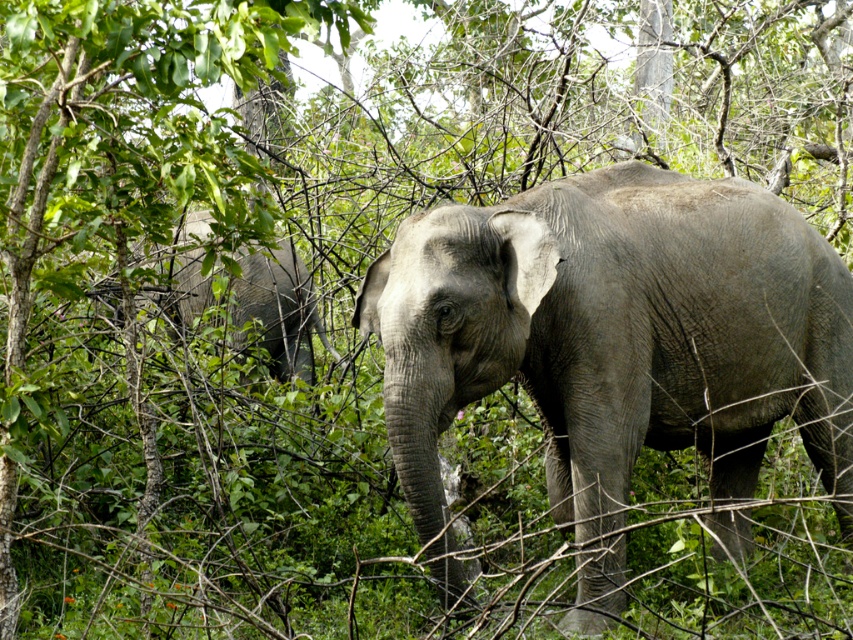
Question: Can you confirm if gray matte elephant at center is bigger than gray matte elephant at left?

Choices:
 (A) no
 (B) yes

Answer: (B)

Question: Does gray matte elephant at center appear over gray matte elephant at left?

Choices:
 (A) no
 (B) yes

Answer: (A)

Question: Is gray matte elephant at center closer to camera compared to gray matte elephant at left?

Choices:
 (A) no
 (B) yes

Answer: (B)

Question: Among these points, which one is nearest to the camera?

Choices:
 (A) click(461, 272)
 (B) click(189, 250)

Answer: (A)

Question: Which point appears farthest from the camera in this image?

Choices:
 (A) (722, 211)
 (B) (228, 296)

Answer: (B)